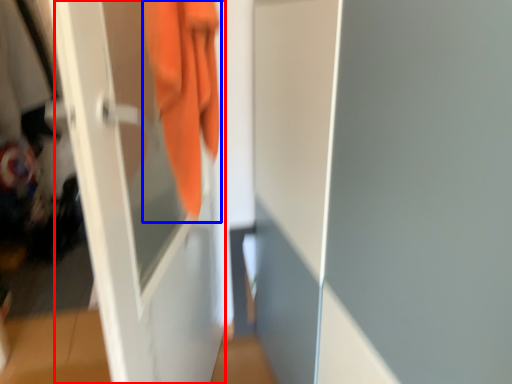
Question: Which point is closer to the camera, screen door (highlighted by a red box) or towel (highlighted by a blue box)?

Choices:
 (A) screen door
 (B) towel

Answer: (A)